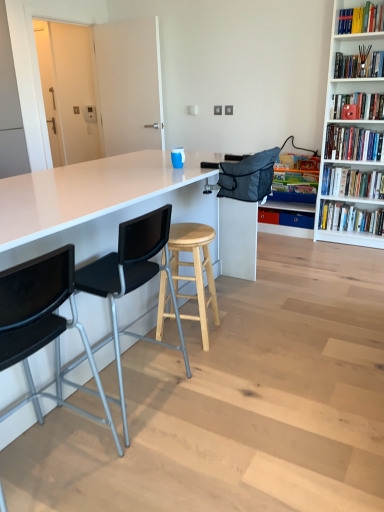
The image size is (384, 512). Find the location of `free space above hardcover book at center, the fifth book in the top-to-bottom sequence (from a real-world perspective)`. free space above hardcover book at center, the fifth book in the top-to-bottom sequence (from a real-world perspective) is located at coordinates (290, 165).